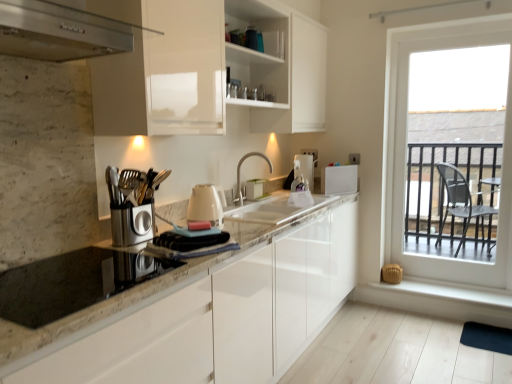
This screenshot has height=384, width=512. What do you see at coordinates (209, 315) in the screenshot? I see `granite countertop at center` at bounding box center [209, 315].

This screenshot has height=384, width=512. What do you see at coordinates (276, 210) in the screenshot? I see `white marble sink at center` at bounding box center [276, 210].

Image resolution: width=512 pixels, height=384 pixels. In order to click on white marble sink at center in this screenshot , I will do `click(276, 210)`.

What do you see at coordinates (244, 160) in the screenshot? The width and height of the screenshot is (512, 384). I see `satin nickel faucet at center` at bounding box center [244, 160].

This screenshot has height=384, width=512. Identify the location of white plastic toaster at upper right, positioned as the 2th appliance in back-to-front order. (339, 179).

Can you confirm if white marble sink at center is thinner than clear glass window at right?

No, white marble sink at center is not thinner than clear glass window at right.

Which object is further away from the camera taking this photo, white marble sink at center or clear glass window at right?

clear glass window at right is behind.

Is white marble sink at center located outside clear glass window at right?

Yes, white marble sink at center is located beyond the bounds of clear glass window at right.

Based on the photo, from a real-world perspective, is white marble sink at center on top of clear glass window at right?

No, from a real-world perspective, white marble sink at center is not on top of clear glass window at right.

From the image's perspective, who appears lower, black glass cooktop at lower left, arranged as the fourth appliance when viewed from the back, or white glossy kettle at center, the 3th appliance positioned from the back?

black glass cooktop at lower left, arranged as the fourth appliance when viewed from the back, is shown below in the image.

Measure the distance between black glass cooktop at lower left, placed as the 1th appliance when sorted from left to right, and white glossy kettle at center, arranged as the 2th appliance when viewed from the front.

black glass cooktop at lower left, placed as the 1th appliance when sorted from left to right, is 23.99 inches away from white glossy kettle at center, arranged as the 2th appliance when viewed from the front.

Considering the sizes of black glass cooktop at lower left, the 1th appliance from the front, and white glossy kettle at center, the 3th appliance positioned from the back, in the image, is black glass cooktop at lower left, the 1th appliance from the front, bigger or smaller than white glossy kettle at center, the 3th appliance positioned from the back,?

In the image, black glass cooktop at lower left, the 1th appliance from the front, appears to be larger than white glossy kettle at center, the 3th appliance positioned from the back.

Consider the image. From a real-world perspective, is black glass cooktop at lower left, arranged as the fourth appliance when viewed from the back, physically below white glossy kettle at center, which ranks as the second appliance in left-to-right order?

Indeed, from a real-world perspective, black glass cooktop at lower left, arranged as the fourth appliance when viewed from the back, is positioned beneath white glossy kettle at center, which ranks as the second appliance in left-to-right order.

Does white glossy cabinet at upper center turn towards satin nickel faucet at center?

No, white glossy cabinet at upper center is not turned towards satin nickel faucet at center.

From the image's perspective, is white glossy cabinet at upper center below satin nickel faucet at center?

Actually, white glossy cabinet at upper center appears above satin nickel faucet at center in the image.

Would you say white glossy cabinet at upper center is outside satin nickel faucet at center?

Yes, white glossy cabinet at upper center is outside of satin nickel faucet at center.

Between stainless steel range hood at upper left and dark blue rubber mat at lower right, which one has less height?

dark blue rubber mat at lower right.

In the scene shown: How far apart are stainless steel range hood at upper left and dark blue rubber mat at lower right?

They are 9.11 feet apart.

Is stainless steel range hood at upper left thinner than dark blue rubber mat at lower right?

Incorrect, the width of stainless steel range hood at upper left is not less than that of dark blue rubber mat at lower right.

From the image's perspective, is stainless steel range hood at upper left over dark blue rubber mat at lower right?

Yes, from the image's perspective, stainless steel range hood at upper left is above dark blue rubber mat at lower right.

Between point (192, 220) and point (276, 216), which one is positioned in front?

The point (192, 220) is closer to the camera.

Is white glossy kettle at center, arranged as the 2th appliance when viewed from the front, not within white marble sink at center?

Absolutely, white glossy kettle at center, arranged as the 2th appliance when viewed from the front, is external to white marble sink at center.

Which is more to the left, white glossy kettle at center, which ranks as the second appliance in left-to-right order, or white marble sink at center?

white glossy kettle at center, which ranks as the second appliance in left-to-right order, is more to the left.

Can you confirm if white glossy kettle at center, arranged as the third appliance when viewed from the right, is taller than white marble sink at center?

Indeed, white glossy kettle at center, arranged as the third appliance when viewed from the right, has a greater height compared to white marble sink at center.

In terms of width, does dark blue rubber mat at lower right look wider or thinner when compared to satin nickel faucet at center?

In the image, dark blue rubber mat at lower right appears to be wider than satin nickel faucet at center.

From the image's perspective, relative to satin nickel faucet at center, is dark blue rubber mat at lower right above or below?

Based on their image positions, dark blue rubber mat at lower right is located beneath satin nickel faucet at center.

Is dark blue rubber mat at lower right oriented towards satin nickel faucet at center?

No, dark blue rubber mat at lower right is not oriented towards satin nickel faucet at center.

Consider the image. Is dark blue rubber mat at lower right in contact with satin nickel faucet at center?

No, dark blue rubber mat at lower right is not next to satin nickel faucet at center.

Which object is positioned more to the right, satin silver coffee machine at left or clear glass window at right?

clear glass window at right.

What's the angular difference between satin silver coffee machine at left and clear glass window at right's facing directions?

90.7 degrees separate the facing orientations of satin silver coffee machine at left and clear glass window at right.

Does point (161, 171) appear closer or farther from the camera than point (430, 261)?

Point (161, 171).

From the image's perspective, is satin silver coffee machine at left over clear glass window at right?

No, from the image's perspective, satin silver coffee machine at left is not on top of clear glass window at right.

The image size is (512, 384). Identify the location of window above the white marble sink at center (from the image's perspective). (407, 142).

At what (x,y) coordinates should I click in order to perform the action: click on appliance on the left of white glossy kettle at center, which ranks as the second appliance in left-to-right order. Please return your answer as a coordinate pair (x, y). The width and height of the screenshot is (512, 384). Looking at the image, I should click on (72, 283).

Which object lies further to the anchor point white smooth window sill at lower right, granite countertop at center or white plastic toaster at upper right, positioned as the 2th appliance in back-to-front order?

granite countertop at center.

Looking at the image, which one is located further to clear glass window at right, white marble sink at center or dark blue rubber mat at lower right?

The object further to clear glass window at right is white marble sink at center.

From the picture: Considering their positions, is granite countertop at center positioned closer to white marble sink at center than white plastic toaster at upper right, positioned as the 2th appliance in back-to-front order?

white plastic toaster at upper right, positioned as the 2th appliance in back-to-front order, lies closer to white marble sink at center than the other object.

Consider the image. From the image, which object appears to be nearer to white smooth window sill at lower right, black glass cooktop at lower left, arranged as the fourth appliance when viewed from the back, or satin nickel faucet at center?

satin nickel faucet at center lies closer to white smooth window sill at lower right than the other object.

From the image, which object appears to be nearer to white glossy cabinet at upper center, white plastic toaster at upper right, placed as the 1th appliance when sorted from right to left, or dark blue rubber mat at lower right?

white plastic toaster at upper right, placed as the 1th appliance when sorted from right to left, lies closer to white glossy cabinet at upper center than the other object.

Looking at the image, which one is located further to white smooth window sill at lower right, stainless steel range hood at upper left or white glossy kettle at center, arranged as the third appliance when viewed from the right?

stainless steel range hood at upper left.

From the image, which object appears to be nearer to clear glass window at right, white glossy cabinet at upper center or black glass cooktop at lower left, the 1th appliance from the front?

Based on the image, white glossy cabinet at upper center appears to be nearer to clear glass window at right.

Estimate the real-world distances between objects in this image. Which object is further from white glossy cabinet at upper center, dark blue rubber mat at lower right or white glossy tissue box at center, arranged as the third appliance when viewed from the left?

Among the two, dark blue rubber mat at lower right is located further to white glossy cabinet at upper center.

I want to click on window between granite countertop at center and white glossy tissue box at center, arranged as the third appliance when viewed from the left, along the z-axis, so click(x=407, y=142).

Locate an element on the screen. The image size is (512, 384). window sill between white glossy cabinet at upper center and dark blue rubber mat at lower right is located at coordinates (449, 292).

Image resolution: width=512 pixels, height=384 pixels. I want to click on sink located between black glass cooktop at lower left, placed as the 4th appliance when sorted from right to left, and white plastic toaster at upper right, the fourth appliance viewed from the left, in the depth direction, so click(276, 210).

Locate an element on the screen. This screenshot has height=384, width=512. sink between satin silver coffee machine at left and dark blue rubber mat at lower right from left to right is located at coordinates (276, 210).